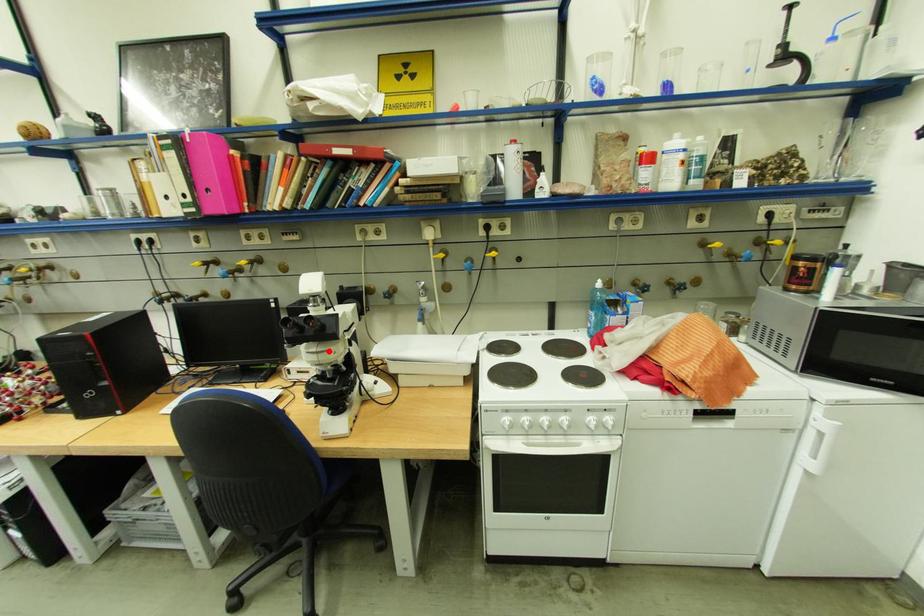
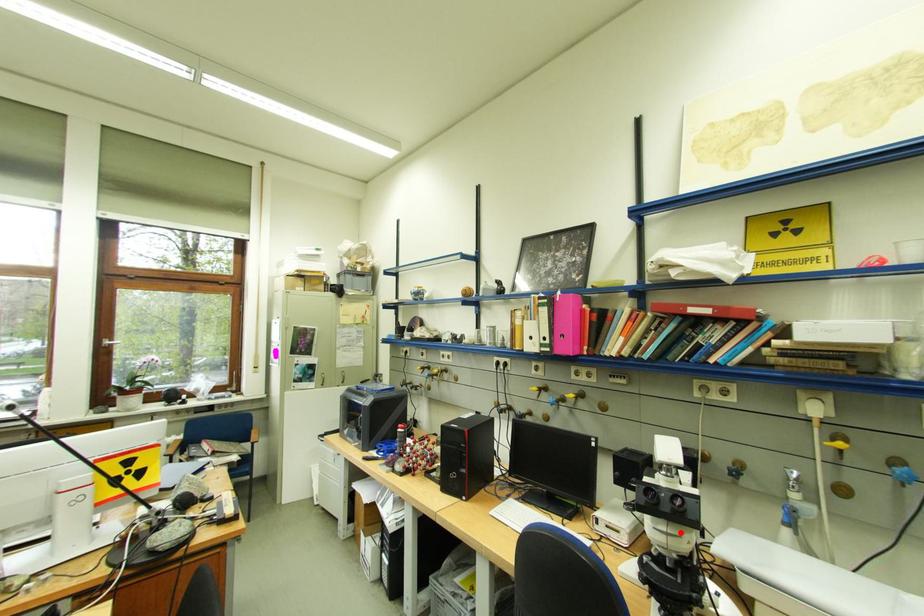
I am providing you with two images of the same scene from different viewpoints. A red point is marked on the first image and another point is marked on the second image. Is the marked point in image1 the same physical position as the marked point in image2?

Yes